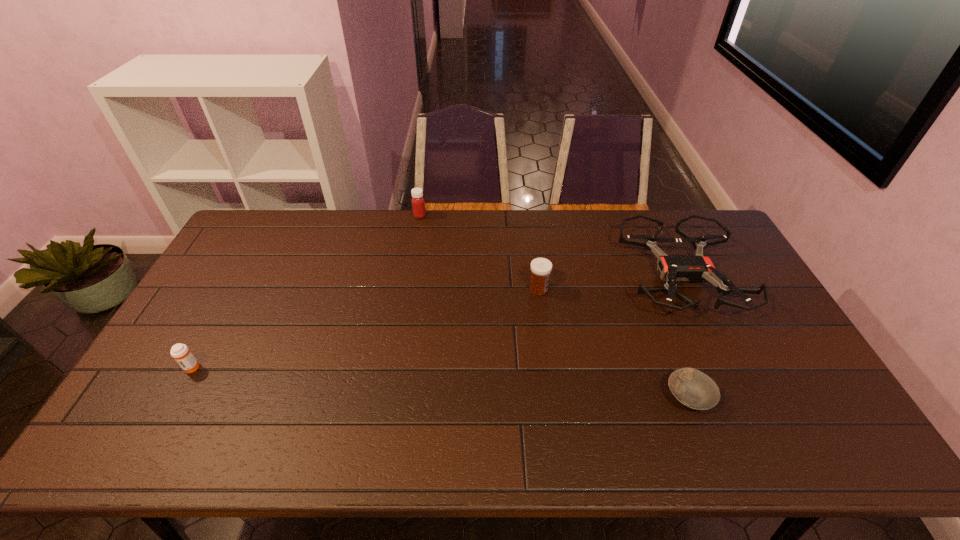
Identify the location of vacant space located on the left of the rightmost medicine. (503, 289).

Locate an element on the screen. vacant region located 0.220m with the camera facing forward on the drone is located at coordinates point(736,398).

The height and width of the screenshot is (540, 960). Identify the location of vacant area located 0.230m on the back of the fourth farthest object. (229, 299).

What are the coordinates of `vacant point located 0.260m on the right of the shortest object` in the screenshot? It's located at (814, 397).

This screenshot has width=960, height=540. Identify the location of medicine that is at the far edge. (418, 203).

Locate an element on the screen. This screenshot has height=540, width=960. drone present at the far edge is located at coordinates (695, 268).

Find the location of `object present at the left edge`. object present at the left edge is located at coordinates (180, 352).

The height and width of the screenshot is (540, 960). Identify the location of object that is positioned at the right edge. (695, 268).

Where is `object that is at the far right corner`? Image resolution: width=960 pixels, height=540 pixels. object that is at the far right corner is located at coordinates (695, 268).

The height and width of the screenshot is (540, 960). Find the location of `free space at the far edge of the desktop`. free space at the far edge of the desktop is located at coordinates (574, 244).